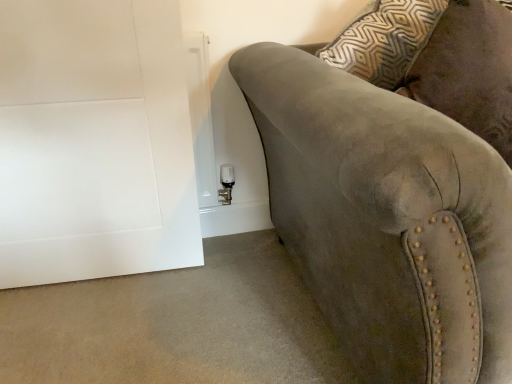
Locate an element on the screen. The image size is (512, 384). white matte door at lower left is located at coordinates (94, 142).

The width and height of the screenshot is (512, 384). What do you see at coordinates (94, 142) in the screenshot?
I see `white matte door at lower left` at bounding box center [94, 142].

What do you see at coordinates (387, 219) in the screenshot? I see `suede couch at right` at bounding box center [387, 219].

You are a GUI agent. You are given a task and a screenshot of the screen. Output one action in this format:
    pyautogui.click(x=<x>, y=<y>)
    Task: Click on the suede couch at right
    The height and width of the screenshot is (384, 512).
    Given the screenshot: What is the action you would take?
    pyautogui.click(x=387, y=219)

You are a GUI agent. You are given a task and a screenshot of the screen. Output one action in this format:
    pyautogui.click(x=<x>, y=<y>)
    Task: Click on the white matte door at lower left
    
    Given the screenshot: What is the action you would take?
    pyautogui.click(x=94, y=142)

Can you confirm if suede couch at right is positioned to the left of white matte door at lower left?

Incorrect, suede couch at right is not on the left side of white matte door at lower left.

Considering the relative positions of suede couch at right and white matte door at lower left in the image provided, is suede couch at right in front of white matte door at lower left?

Yes.

Which is less distant, (x=347, y=196) or (x=118, y=106)?

Point (x=347, y=196) is positioned closer to the camera compared to point (x=118, y=106).

From the image's perspective, which object appears higher, suede couch at right or white matte door at lower left?

white matte door at lower left appears higher in the image.

From a real-world perspective, which is physically above, suede couch at right or white matte door at lower left?

white matte door at lower left.

Between suede couch at right and white matte door at lower left, which one has larger width?

Wider between the two is suede couch at right.

From their relative heights in the image, would you say suede couch at right is taller or shorter than white matte door at lower left?

suede couch at right is shorter than white matte door at lower left.

Considering the sizes of objects suede couch at right and white matte door at lower left in the image provided, who is bigger, suede couch at right or white matte door at lower left?

Bigger between the two is suede couch at right.

Is white matte door at lower left surrounded by suede couch at right?

That's incorrect, white matte door at lower left is not inside suede couch at right.

Is suede couch at right not close to white matte door at lower left?

Actually, suede couch at right and white matte door at lower left are a little close together.

Does suede couch at right turn towards white matte door at lower left?

No.

Can you tell me how much suede couch at right and white matte door at lower left differ in facing direction?

There is a 3.83-degree angle between the facing directions of suede couch at right and white matte door at lower left.

Where is `studio couch that is on the right side of white matte door at lower left`? Image resolution: width=512 pixels, height=384 pixels. studio couch that is on the right side of white matte door at lower left is located at coordinates (387, 219).

Which object is positioned more to the right, white matte door at lower left or suede couch at right?

From the viewer's perspective, suede couch at right appears more on the right side.

Based on the photo, is white matte door at lower left positioned behind suede couch at right?

Yes, the depth of white matte door at lower left is greater than that of suede couch at right.

Which point is more distant from viewer, (165,47) or (377,263)?

The point (165,47) is farther.

From the image's perspective, is white matte door at lower left above or below suede couch at right?

From the image's perspective, white matte door at lower left appears above suede couch at right.

Based on the photo, from a real-world perspective, which is physically above, white matte door at lower left or suede couch at right?

In real-world perspective, white matte door at lower left is above.

Is white matte door at lower left wider or thinner than suede couch at right?

white matte door at lower left is thinner than suede couch at right.

From the picture: Considering the sizes of white matte door at lower left and suede couch at right in the image, is white matte door at lower left taller or shorter than suede couch at right?

Clearly, white matte door at lower left is taller compared to suede couch at right.

Considering the sizes of objects white matte door at lower left and suede couch at right in the image provided, who is bigger, white matte door at lower left or suede couch at right?

With larger size is suede couch at right.

Do you think white matte door at lower left is within suede couch at right, or outside of it?

white matte door at lower left cannot be found inside suede couch at right.

Would you say white matte door at lower left is a long distance from suede couch at right?

Actually, white matte door at lower left and suede couch at right are a little close together.

Is white matte door at lower left facing away from suede couch at right?

white matte door at lower left is not turned away from suede couch at right.

Find the location of a particular element. This screenshot has height=384, width=512. studio couch below the white matte door at lower left (from the image's perspective) is located at coordinates (387, 219).

Locate an element on the screen. door above the suede couch at right (from the image's perspective) is located at coordinates (94, 142).

Where is `door lying on the left of suede couch at right`? Image resolution: width=512 pixels, height=384 pixels. door lying on the left of suede couch at right is located at coordinates (94, 142).